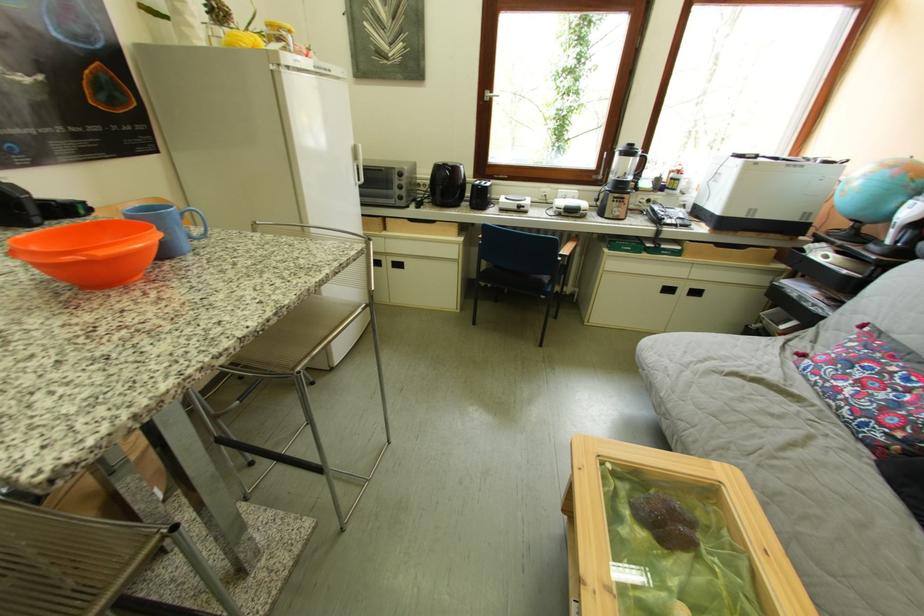
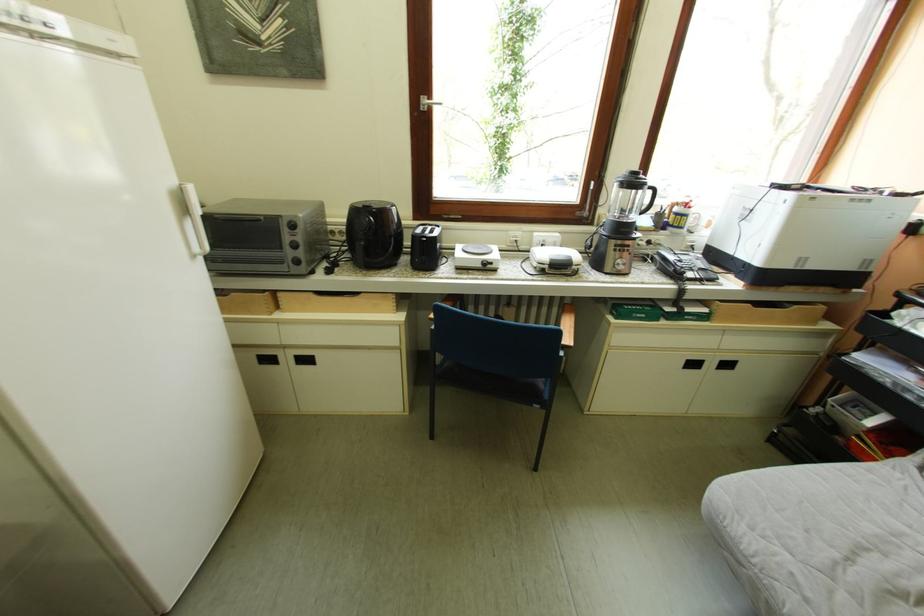
Question: Based on the continuous images, in which direction is the camera rotating? Reply with the corresponding letter.

Choices:
 (A) Left
 (B) Right
 (C) Up
 (D) Down

Answer: (B)